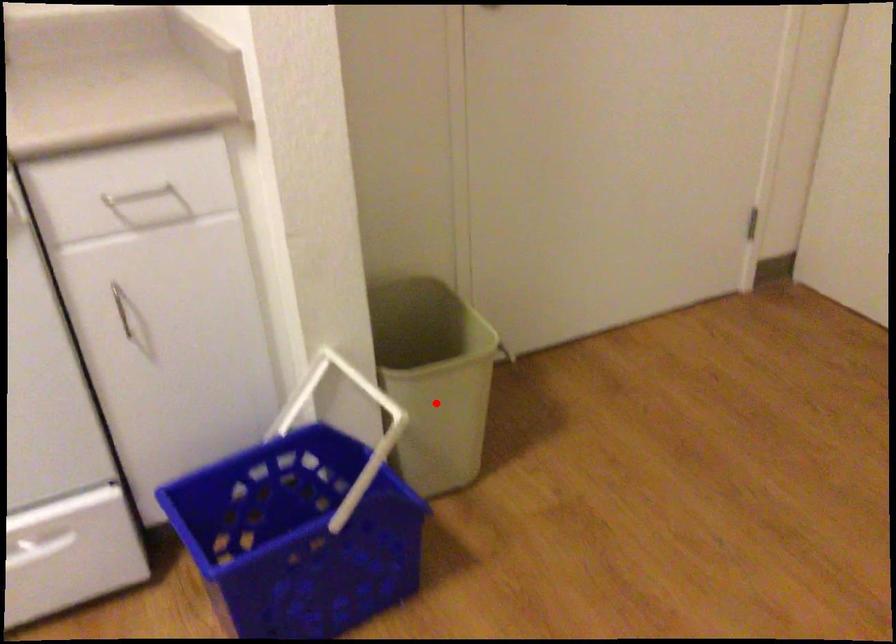
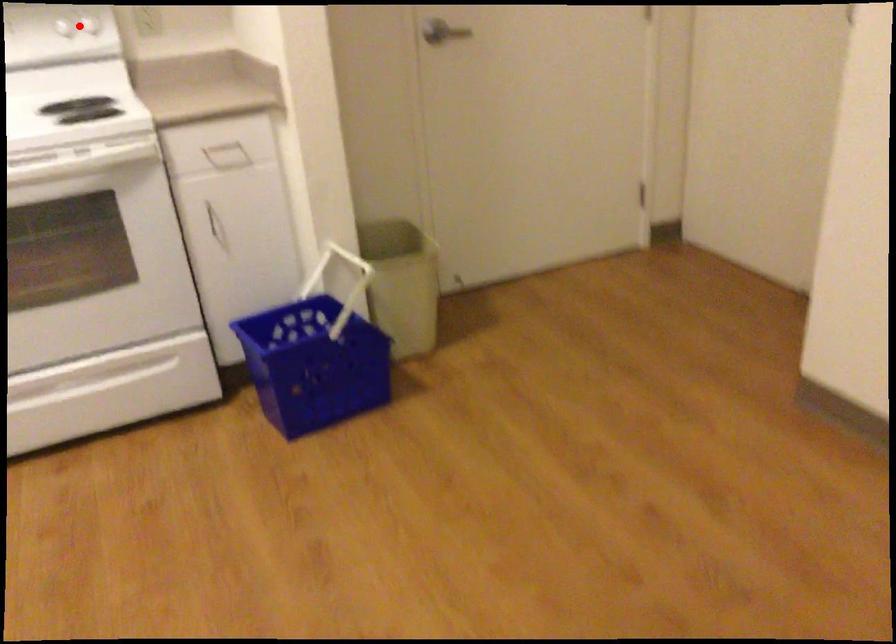
I am providing you with two images of the same scene from different viewpoints. A red point is marked on the first image and another point is marked on the second image. Does the point marked in image1 correspond to the same location as the one in image2?

No